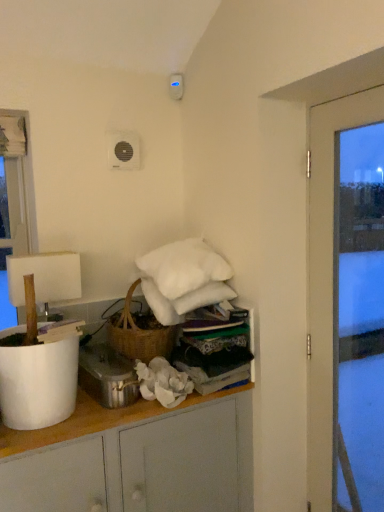
Identify the location of white fluffy pillow at upper center. The height and width of the screenshot is (512, 384). (184, 267).

The image size is (384, 512). Describe the element at coordinates (184, 267) in the screenshot. I see `white fluffy pillow at upper center` at that location.

Locate an element on the screen. white matte cabinet at center is located at coordinates (135, 458).

From the image's perspective, is transparent glass door at right on top of white fluffy pillow at upper center?

Actually, transparent glass door at right appears below white fluffy pillow at upper center in the image.

Which is closer, (324,316) or (200,262)?

Point (324,316) is positioned closer to the camera compared to point (200,262).

Between transparent glass door at right and white fluffy pillow at upper center, which one has smaller size?

white fluffy pillow at upper center.

Is transparent glass door at right facing away from white fluffy pillow at upper center?

transparent glass door at right is not turned away from white fluffy pillow at upper center.

Is white fluffy pillow at upper center placed right next to transparent glass door at right?

No, white fluffy pillow at upper center is not touching transparent glass door at right.

From a real-world perspective, which object stands above the other?

white fluffy pillow at upper center, from a real-world perspective.

Considering the sizes of objects white fluffy pillow at upper center and transparent glass door at right in the image provided, who is thinner, white fluffy pillow at upper center or transparent glass door at right?

transparent glass door at right is thinner.

From a real-world perspective, is white matte cabinet at center positioned over transparent glass door at right based on gravity?

Incorrect, from a real-world perspective, white matte cabinet at center is lower than transparent glass door at right.

Consider the image. Considering the sizes of objects white matte cabinet at center and transparent glass door at right in the image provided, who is shorter, white matte cabinet at center or transparent glass door at right?

white matte cabinet at center.

From the image's perspective, is white matte cabinet at center located above transparent glass door at right?

No, from the image's perspective, white matte cabinet at center is not over transparent glass door at right.

Is white matte cabinet at center closer to the viewer compared to transparent glass door at right?

Yes, white matte cabinet at center is closer to the viewer.

Which is more to the left, white fabric at upper center or transparent glass door at right?

white fabric at upper center is more to the left.

Is point (237, 340) in front of point (319, 113)?

No, (237, 340) is further to viewer.

From a real-world perspective, is white fabric at upper center physically located above or below transparent glass door at right?

white fabric at upper center is situated lower than transparent glass door at right in the real world.

Based on their sizes in the image, would you say white fabric at upper center is bigger or smaller than transparent glass door at right?

In the image, white fabric at upper center appears to be smaller than transparent glass door at right.

In terms of height, does metallic silver pot at lower center look taller or shorter compared to transparent glass door at right?

metallic silver pot at lower center is shorter than transparent glass door at right.

From the image's perspective, is metallic silver pot at lower center located above or below transparent glass door at right?

Based on their image positions, metallic silver pot at lower center is located beneath transparent glass door at right.

Would you say metallic silver pot at lower center is to the left or to the right of transparent glass door at right in the picture?

metallic silver pot at lower center is positioned on transparent glass door at right's left side.

At what (x,y) coordinates should I click in order to perform the action: click on appliance below the transparent glass door at right (from a real-world perspective). Please return your answer as a coordinate pair (x, y). This screenshot has height=512, width=384. Looking at the image, I should click on [109, 375].

Between metallic silver pot at lower center and white fluffy pillow at upper center, which one has more height?

Standing taller between the two is white fluffy pillow at upper center.

From the image's perspective, which one is positioned higher, metallic silver pot at lower center or white fluffy pillow at upper center?

white fluffy pillow at upper center.

Which is behind, point (93, 371) or point (165, 284)?

Positioned behind is point (165, 284).

Is white matte cabinet at center outside of white fluffy pillow at upper center?

Yes, white matte cabinet at center is not within white fluffy pillow at upper center.

From a real-world perspective, does white matte cabinet at center stand above white fluffy pillow at upper center?

No, from a real-world perspective, white matte cabinet at center is not above white fluffy pillow at upper center.

Considering the sizes of white matte cabinet at center and white fluffy pillow at upper center in the image, is white matte cabinet at center bigger or smaller than white fluffy pillow at upper center?

Considering their sizes, white matte cabinet at center takes up more space than white fluffy pillow at upper center.

Does point (152, 441) appear closer or farther from the camera than point (212, 257)?

Point (152, 441) appears to be closer to the viewer than point (212, 257).

At what (x,y) coordinates should I click in order to perform the action: click on pillow that is above the transparent glass door at right (from the image's perspective). Please return your answer as a coordinate pair (x, y). Looking at the image, I should click on (184, 267).

The image size is (384, 512). I want to click on door below the white fluffy pillow at upper center (from a real-world perspective), so click(326, 278).

Which object lies further to the anchor point transparent glass door at right, metallic silver pot at lower center or white fluffy pillow at upper center?

The object further to transparent glass door at right is metallic silver pot at lower center.

Considering their positions, is white matte lampshade at left positioned further to white fabric at upper center than white matte cabinet at center?

Based on the image, white matte lampshade at left appears to be further to white fabric at upper center.

Which object lies nearer to the anchor point white fluffy pillow at upper center, white fabric at upper center or white matte lampshade at left?

white fabric at upper center.

From the image, which object appears to be nearer to white fluffy pillow at upper center, white matte cabinet at center or metallic silver pot at lower center?

Among the two, metallic silver pot at lower center is located nearer to white fluffy pillow at upper center.

Considering their positions, is white matte lampshade at left positioned further to white fabric at upper center than metallic silver pot at lower center?

The object further to white fabric at upper center is white matte lampshade at left.

Considering their positions, is white matte lampshade at left positioned further to transparent glass door at right than white matte cabinet at center?

The object further to transparent glass door at right is white matte lampshade at left.

When comparing their distances from transparent glass door at right, does white matte cabinet at center or metallic silver pot at lower center seem further?

Among the two, metallic silver pot at lower center is located further to transparent glass door at right.

Which object lies further to the anchor point transparent glass door at right, metallic silver pot at lower center or white fabric at upper center?

Among the two, metallic silver pot at lower center is located further to transparent glass door at right.

You are a GUI agent. You are given a task and a screenshot of the screen. Output one action in this format:
    pyautogui.click(x=<x>, y=<y>)
    Task: Click on the pillow between metallic silver pot at lower center and transparent glass door at right
    Image resolution: width=384 pixels, height=512 pixels.
    Given the screenshot: What is the action you would take?
    pyautogui.click(x=184, y=267)

Locate an element on the screen. Image resolution: width=384 pixels, height=512 pixels. appliance situated between white matte lampshade at left and white fabric at upper center from left to right is located at coordinates (109, 375).

At what (x,y) coordinates should I click in order to perform the action: click on shelf between white matte lampshade at left and white matte cabinet at center vertically. Please return your answer as a coordinate pair (x, y). The width and height of the screenshot is (384, 512). Looking at the image, I should click on (218, 353).

You are a GUI agent. You are given a task and a screenshot of the screen. Output one action in this format:
    pyautogui.click(x=<x>, y=<y>)
    Task: Click on the pillow between white matte cabinet at center and transparent glass door at right
    This screenshot has height=512, width=384.
    Given the screenshot: What is the action you would take?
    pyautogui.click(x=184, y=267)